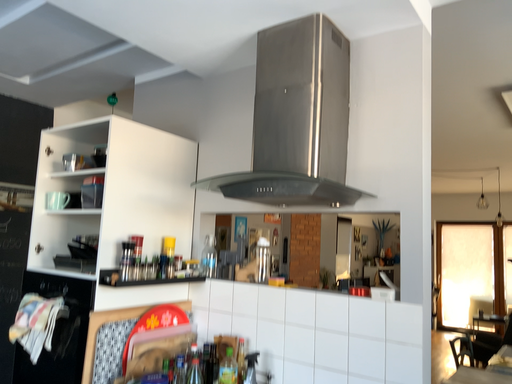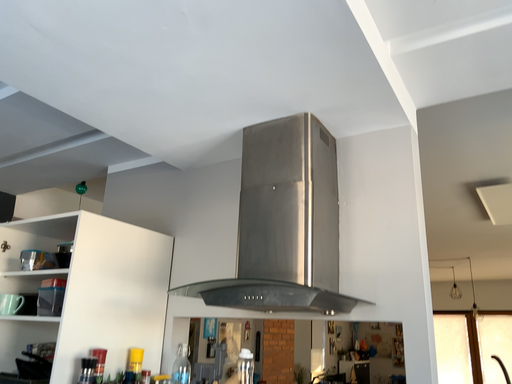
Question: Which way did the camera rotate in the video?

Choices:
 (A) rotated downward
 (B) rotated upward

Answer: (B)